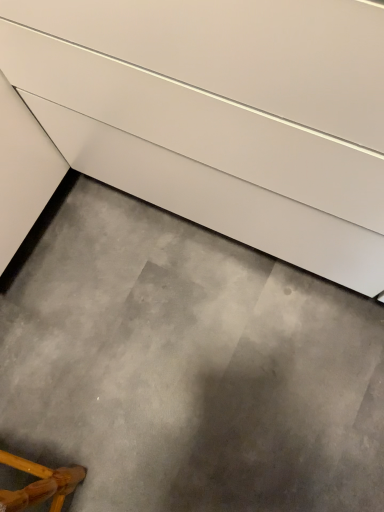
Identify the location of empty space that is ontop of gray concrete at lower center. Image resolution: width=384 pixels, height=512 pixels. (179, 376).